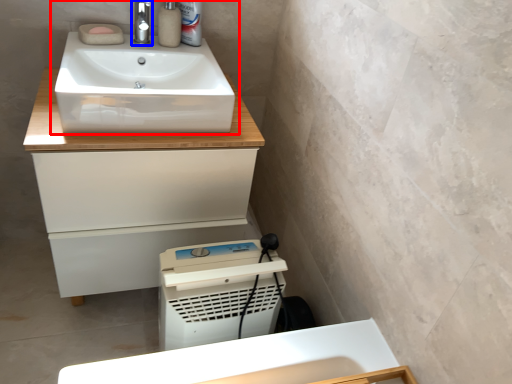
Question: Which point is further to the camera, sink (highlighted by a red box) or tap (highlighted by a blue box)?

Choices:
 (A) sink
 (B) tap

Answer: (B)